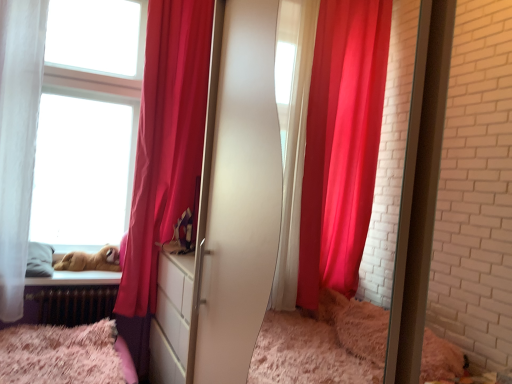
What is the approximate height of brown plush toy at lower left?

The height of brown plush toy at lower left is 7.22 inches.

The image size is (512, 384). What do you see at coordinates (166, 141) in the screenshot? I see `silky red curtain at left` at bounding box center [166, 141].

What are the coordinates of `fluffy pink bed at lower left` in the screenshot? It's located at (62, 354).

Would you say brown plush toy at lower left is part of fluffy pink bed at lower left's contents?

That's incorrect, brown plush toy at lower left is not inside fluffy pink bed at lower left.

In the scene shown: From the image's perspective, which object appears higher, fluffy pink bed at lower left or brown plush toy at lower left?

brown plush toy at lower left.

Which is farther, (x=103, y=365) or (x=56, y=265)?

The point (x=56, y=265) is more distant.

Looking at this image, does fluffy pink bed at lower left have a lesser height compared to brown plush toy at lower left?

No, fluffy pink bed at lower left is not shorter than brown plush toy at lower left.

Can you confirm if silky red curtain at left is wider than fluffy pink bed at lower left?

Yes, silky red curtain at left is wider than fluffy pink bed at lower left.

Could you tell me if silky red curtain at left is facing fluffy pink bed at lower left?

No.

Would you say silky red curtain at left is a long distance from fluffy pink bed at lower left?

No, silky red curtain at left is in close proximity to fluffy pink bed at lower left.

From a real-world perspective, which object stands above the other?

silky red curtain at left.

From the image's perspective, does brown plush toy at lower left appear lower than silky red curtain at left?

Indeed, from the image's perspective, brown plush toy at lower left is shown beneath silky red curtain at left.

Is brown plush toy at lower left taller than silky red curtain at left?

No, brown plush toy at lower left is not taller than silky red curtain at left.

How many degrees apart are the facing directions of brown plush toy at lower left and silky red curtain at left?

The angular difference between brown plush toy at lower left and silky red curtain at left is 5.04 degrees.

From the picture: How different are the orientations of silky red curtain at left and brown plush toy at lower left in degrees?

The angular difference between silky red curtain at left and brown plush toy at lower left is 5.04 degrees.

In terms of height, does silky red curtain at left look taller or shorter compared to brown plush toy at lower left?

Considering their sizes, silky red curtain at left has more height than brown plush toy at lower left.

Considering the relative sizes of silky red curtain at left and brown plush toy at lower left in the image provided, is silky red curtain at left bigger than brown plush toy at lower left?

Correct, silky red curtain at left is larger in size than brown plush toy at lower left.

From the image's perspective, is silky red curtain at left beneath brown plush toy at lower left?

No, from the image's perspective, silky red curtain at left is not beneath brown plush toy at lower left.

From a real-world perspective, is fluffy pink bed at lower left located higher than silky red curtain at left?

No, from a real-world perspective, fluffy pink bed at lower left is not on top of silky red curtain at left.

Could you tell me if fluffy pink bed at lower left is turned towards silky red curtain at left?

No, fluffy pink bed at lower left is not turned towards silky red curtain at left.

Is fluffy pink bed at lower left at the left side of silky red curtain at left?

Indeed, fluffy pink bed at lower left is positioned on the left side of silky red curtain at left.

Which of these two, brown plush toy at lower left or fluffy pink bed at lower left, is bigger?

With larger size is fluffy pink bed at lower left.

Can you confirm if brown plush toy at lower left is wider than fluffy pink bed at lower left?

Yes, brown plush toy at lower left is wider than fluffy pink bed at lower left.

In the scene shown: How many degrees apart are the facing directions of brown plush toy at lower left and fluffy pink bed at lower left?

4.03 degrees.

Is there a large distance between brown plush toy at lower left and fluffy pink bed at lower left?

No, brown plush toy at lower left is not far away from fluffy pink bed at lower left.

This screenshot has height=384, width=512. Find the location of `animal above the fluffy pink bed at lower left (from the image's perspective)`. animal above the fluffy pink bed at lower left (from the image's perspective) is located at coordinates (91, 260).

This screenshot has height=384, width=512. In order to click on bed below the silky red curtain at left (from a real-world perspective) in this screenshot , I will do `click(62, 354)`.

Looking at this image, when comparing their distances from fluffy pink bed at lower left, does brown plush toy at lower left or silky red curtain at left seem closer?

Based on the image, brown plush toy at lower left appears to be nearer to fluffy pink bed at lower left.

Based on their spatial positions, is fluffy pink bed at lower left or brown plush toy at lower left further from silky red curtain at left?

Based on the image, fluffy pink bed at lower left appears to be further to silky red curtain at left.

When comparing their distances from brown plush toy at lower left, does fluffy pink bed at lower left or silky red curtain at left seem further?

Among the two, silky red curtain at left is located further to brown plush toy at lower left.

When comparing their distances from brown plush toy at lower left, does silky red curtain at left or fluffy pink bed at lower left seem further?

silky red curtain at left lies further to brown plush toy at lower left than the other object.

Looking at this image, estimate the real-world distances between objects in this image. Which object is further from silky red curtain at left, brown plush toy at lower left or fluffy pink bed at lower left?

Based on the image, fluffy pink bed at lower left appears to be further to silky red curtain at left.

Based on their spatial positions, is silky red curtain at left or brown plush toy at lower left closer to fluffy pink bed at lower left?

brown plush toy at lower left is closer to fluffy pink bed at lower left.

Find the location of a particular element. Image resolution: width=512 pixels, height=384 pixels. animal between silky red curtain at left and fluffy pink bed at lower left vertically is located at coordinates (91, 260).